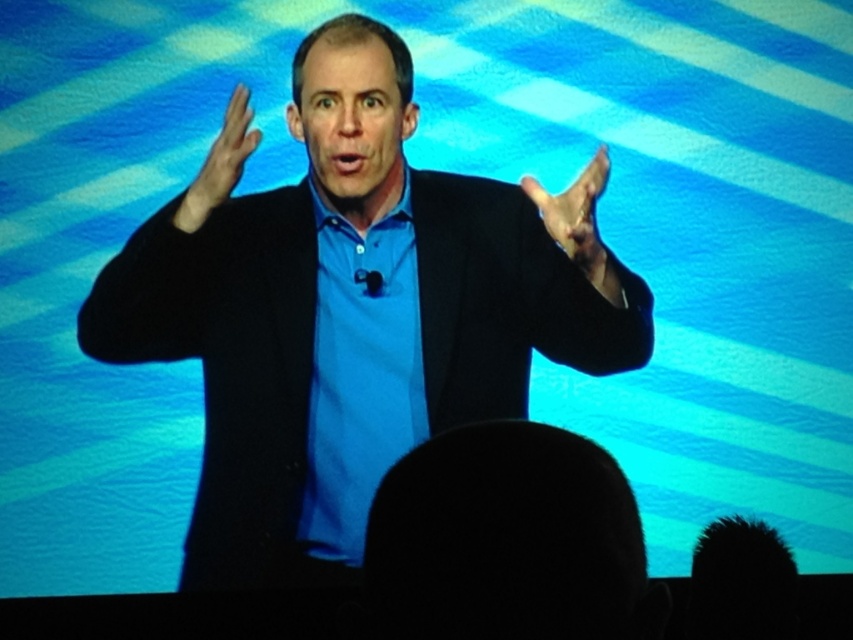
This screenshot has width=853, height=640. I want to click on black matte suit at center, so pos(347,317).

Who is more distant from viewer, (390, 432) or (415, 420)?

The point (390, 432) is more distant.

This screenshot has height=640, width=853. I want to click on black matte suit at center, so click(x=347, y=317).

Between point (310, 520) and point (196, 195), which one is positioned behind?

Point (310, 520)

Looking at this image, can you confirm if blue cotton shirt at center is positioned above matte black hand at upper center?

No.

The image size is (853, 640). What do you see at coordinates (360, 372) in the screenshot? I see `blue cotton shirt at center` at bounding box center [360, 372].

This screenshot has width=853, height=640. Identify the location of blue cotton shirt at center. (360, 372).

Who is lower down, black matte suit at center or matte black hand at upper center?

black matte suit at center is below.

What do you see at coordinates (347, 317) in the screenshot? The height and width of the screenshot is (640, 853). I see `black matte suit at center` at bounding box center [347, 317].

The image size is (853, 640). What do you see at coordinates (347, 317) in the screenshot? I see `black matte suit at center` at bounding box center [347, 317].

Where is `black matte suit at center`? Image resolution: width=853 pixels, height=640 pixels. black matte suit at center is located at coordinates (347, 317).